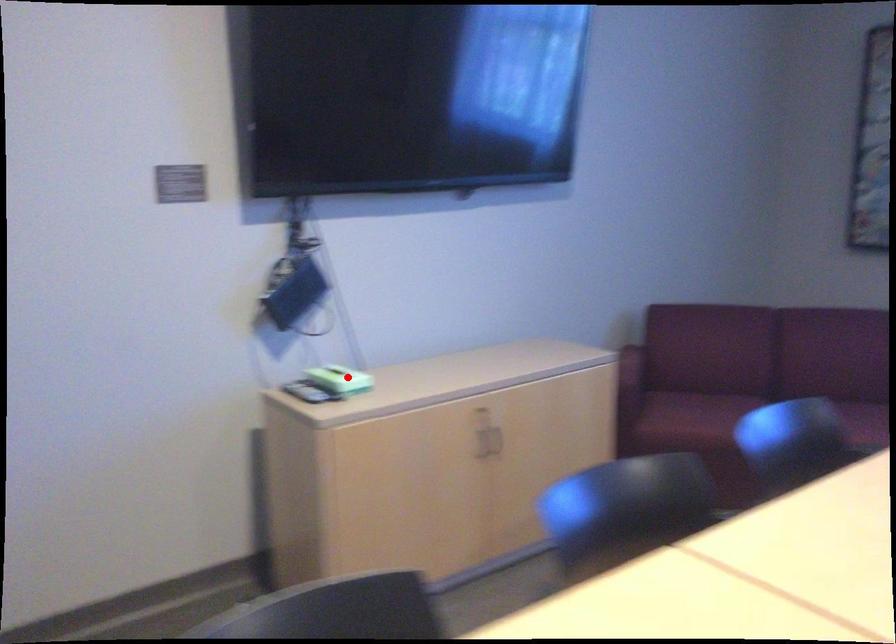
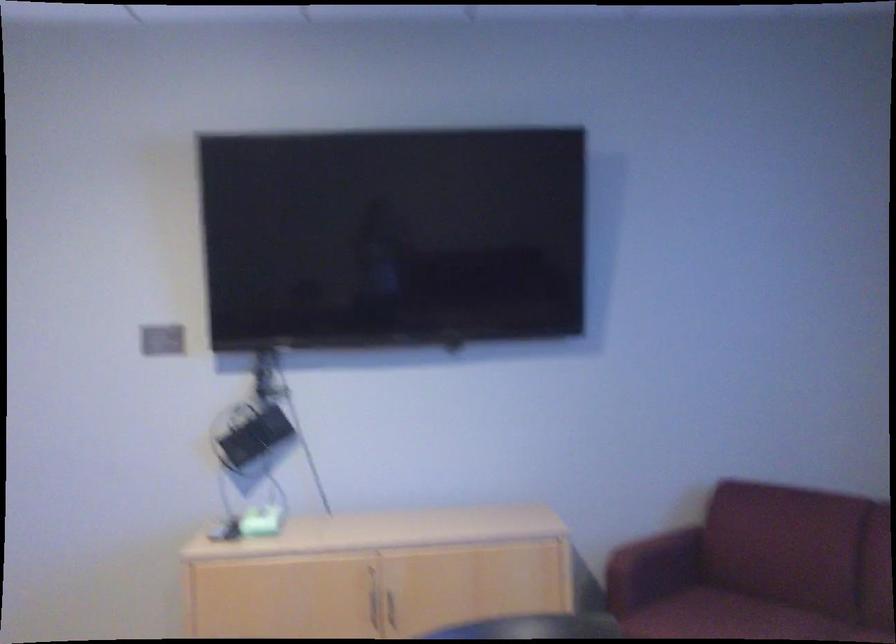
Locate, in the second image, the point that corresponds to the highlighted location in the first image.

(257, 522)